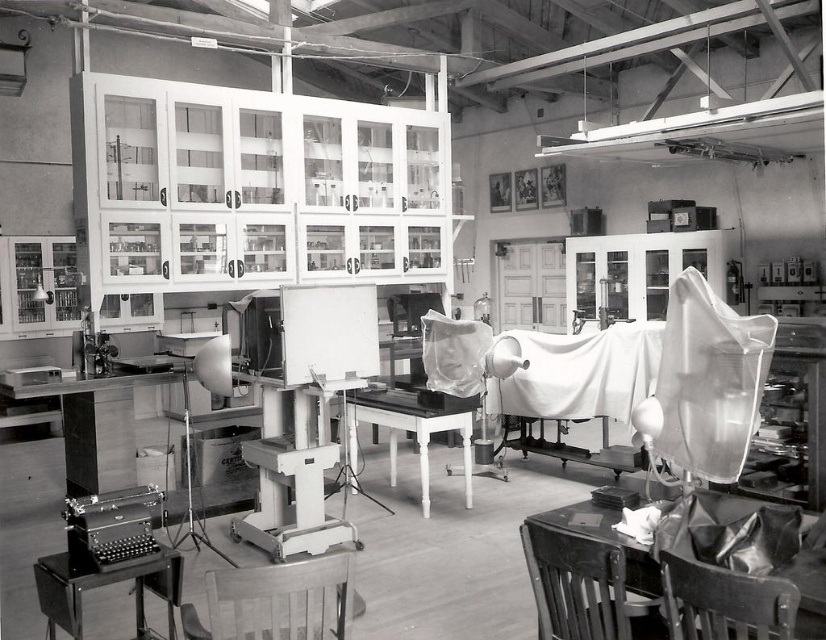
Between point (198, 620) and point (573, 605), which one is positioned behind?

Point (198, 620)

Looking at this image, does wooden chair at lower center come behind dark wood chair at lower right?

No, it is not.

Is point (276, 637) positioned in front of point (597, 547)?

Yes.

Image resolution: width=826 pixels, height=640 pixels. What are the coordinates of `wooden chair at lower center` in the screenshot? It's located at tap(274, 602).

Measure the distance between wooden chair at lower right and camera.

The distance of wooden chair at lower right from camera is 5.66 feet.

Which of these two, wooden chair at lower right or smooth white table at center, stands shorter?

wooden chair at lower right

Where is `wooden chair at lower right`? wooden chair at lower right is located at coordinates (724, 602).

Does point (317, 580) lie behind point (673, 570)?

Yes, it is.

Is wooden chair at lower center above wooden chair at lower right?

Incorrect, wooden chair at lower center is not positioned above wooden chair at lower right.

Who is more distant from viewer, (250, 593) or (777, 621)?

The point (250, 593) is behind.

Find the location of a particular element. wooden chair at lower center is located at coordinates (274, 602).